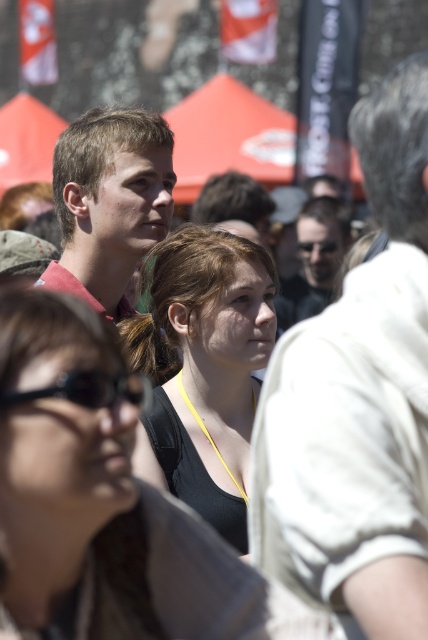
Question: Is matte black tank top at center closer to the viewer compared to black matte goggles at center?

Choices:
 (A) no
 (B) yes

Answer: (B)

Question: Does white cotton shirt at upper right have a lesser width compared to black rubber goggles at lower left?

Choices:
 (A) no
 (B) yes

Answer: (A)

Question: Which object appears closest to the camera in this image?

Choices:
 (A) matte black sunglasses at center
 (B) black fabric tank top at center
 (C) black matte goggles at center

Answer: (B)

Question: Does black fabric tank top at center appear over matte black tank top at center?

Choices:
 (A) yes
 (B) no

Answer: (B)

Question: Based on their relative distances, which object is farther from the matte black sunglasses at center?

Choices:
 (A) black rubber goggles at lower left
 (B) black matte goggles at center
 (C) smooth brown hair at center
 (D) matte red shirt at center

Answer: (A)

Question: Which point appears closest to the camera in this image?

Choices:
 (A) (41, 275)
 (B) (241, 204)
 (C) (64, 376)
 (D) (39, 296)

Answer: (C)